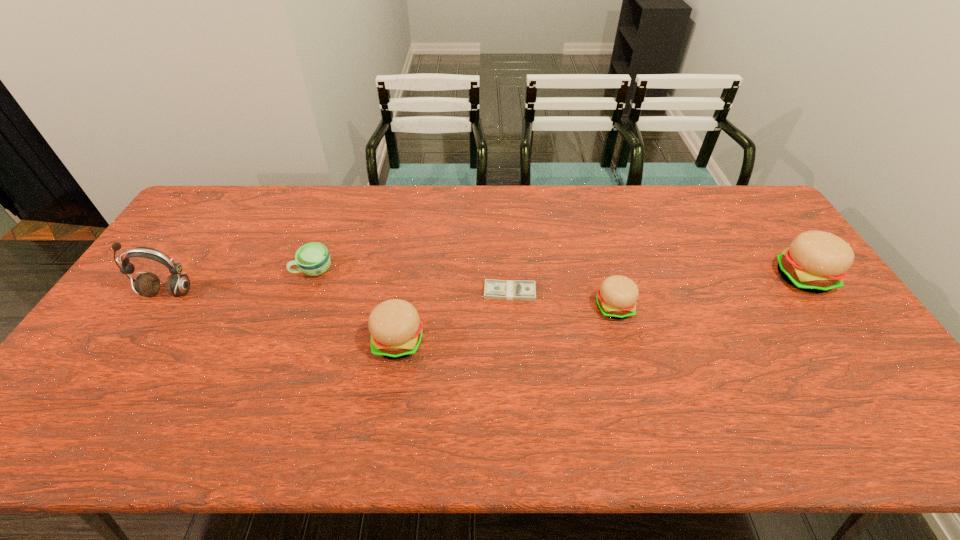
Locate an element on the screen. The height and width of the screenshot is (540, 960). the shortest object is located at coordinates (493, 289).

The image size is (960, 540). What are the coordinates of `dollar` in the screenshot? It's located at (493, 289).

I want to click on vacant space located on the right of the fourth object from right to left, so click(x=509, y=342).

I want to click on free space located 0.110m on the front of the second hamburger from left to right, so click(x=627, y=356).

Where is `blank space located 0.310m on the back of the rightmost object`? The image size is (960, 540). blank space located 0.310m on the back of the rightmost object is located at coordinates (748, 200).

Locate an element on the screen. The width and height of the screenshot is (960, 540). vacant space located 0.230m on the right of the fifth tallest object is located at coordinates (409, 270).

Locate an element on the screen. free space located 0.300m on the ear pads of the earphone is located at coordinates (98, 399).

At what (x,y) coordinates should I click in order to perform the action: click on vacant region located 0.220m on the front of the dollar. Please return your answer as a coordinate pair (x, y). This screenshot has height=540, width=960. Looking at the image, I should click on (515, 368).

Where is `object located in the left edge section of the desktop`? Image resolution: width=960 pixels, height=540 pixels. object located in the left edge section of the desktop is located at coordinates (148, 284).

I want to click on object at the right edge, so click(816, 262).